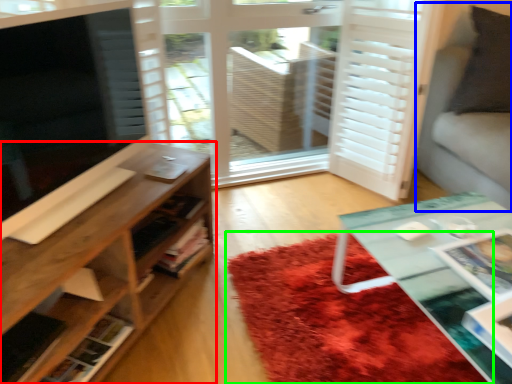
Question: Estimate the real-world distances between objects in this image. Which object is farther from shelf (highlighted by a red box), couch (highlighted by a blue box) or mat (highlighted by a green box)?

Choices:
 (A) couch
 (B) mat

Answer: (A)